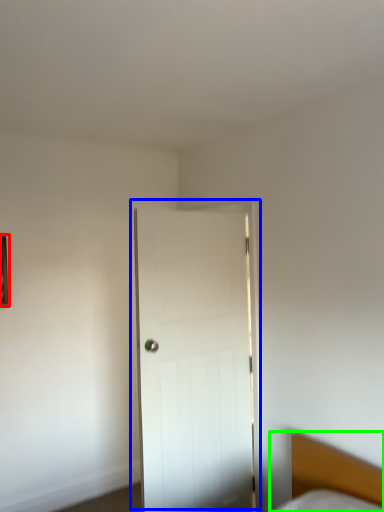
Question: Considering the real-world distances, which object is farthest from picture frame (highlighted by a red box)? door (highlighted by a blue box) or bed (highlighted by a green box)?

Choices:
 (A) door
 (B) bed

Answer: (B)